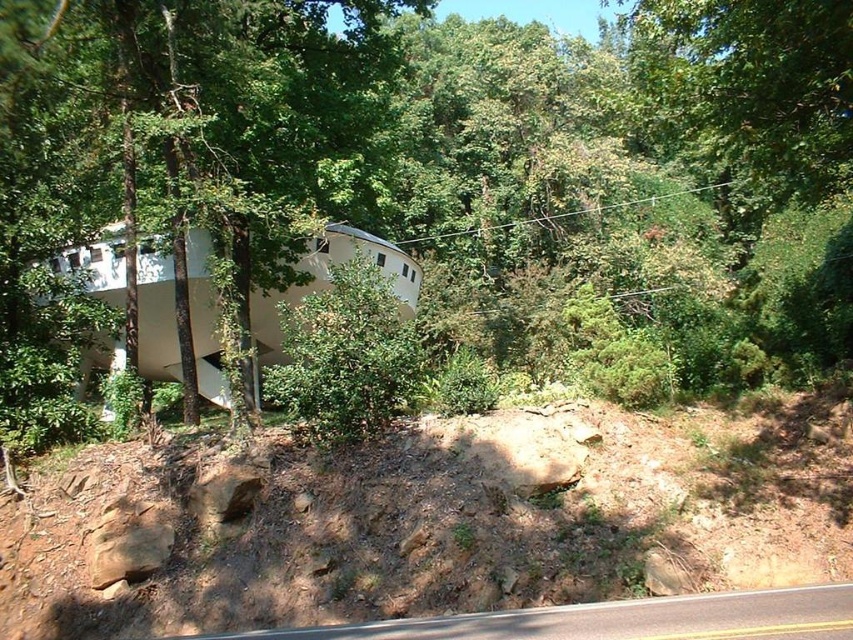
Which is behind, point (796, 54) or point (73, 554)?

Point (73, 554)

Does green leafy tree at center have a lesser height compared to dull brown dirt at lower center?

Incorrect, green leafy tree at center's height does not fall short of dull brown dirt at lower center's.

This screenshot has width=853, height=640. Find the location of `green leafy tree at center`. green leafy tree at center is located at coordinates (431, 173).